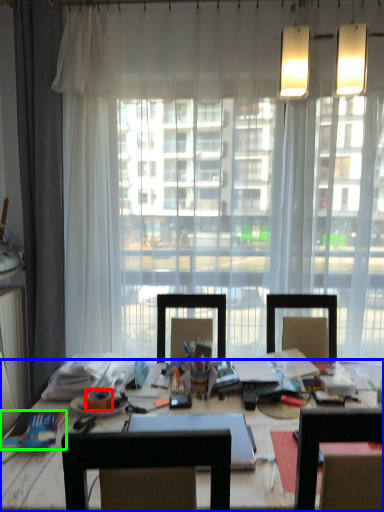
Question: Considering the real-world distances, which object is farthest from adhesive tape (highlighted by a red box)? desk (highlighted by a blue box) or book (highlighted by a green box)?

Choices:
 (A) desk
 (B) book

Answer: (A)